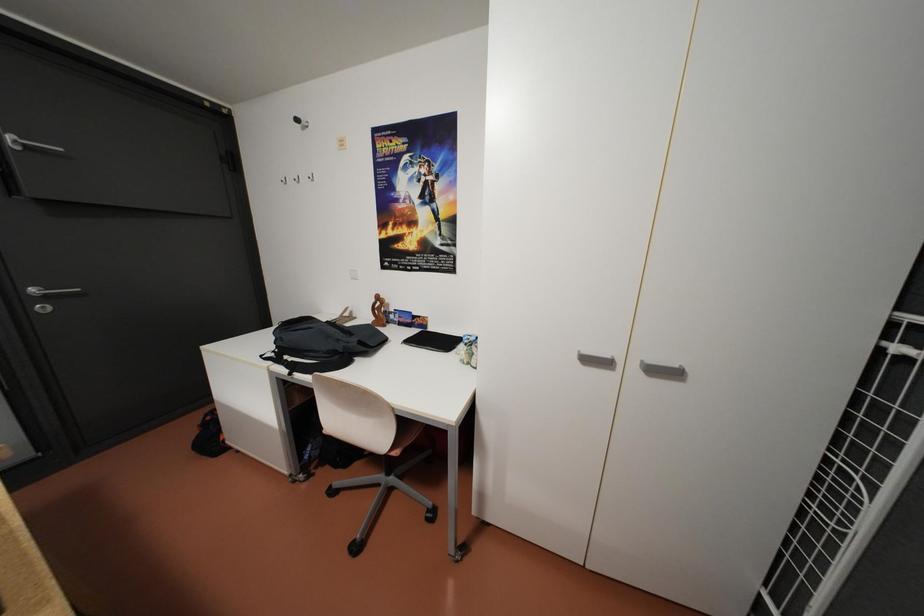
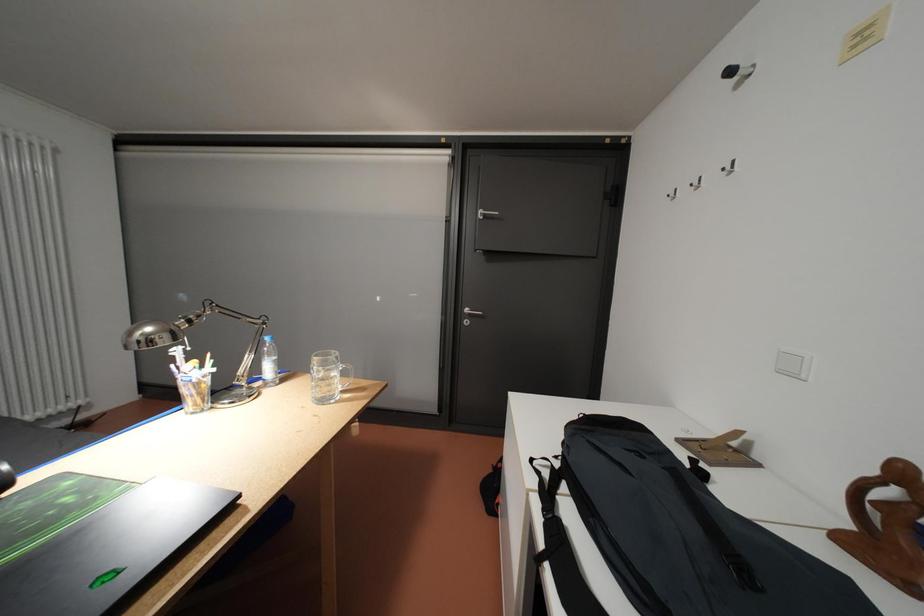
Question: How did the camera likely rotate?

Choices:
 (A) Left
 (B) Right
 (C) Up
 (D) Down

Answer: (A)